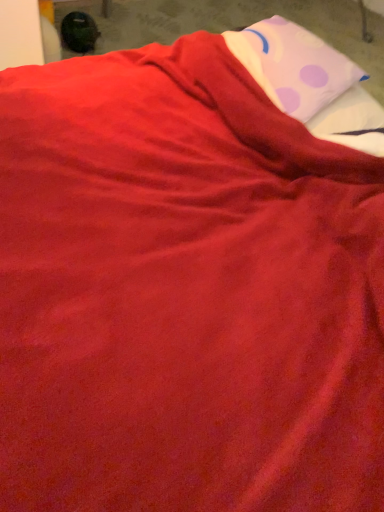
The height and width of the screenshot is (512, 384). Describe the element at coordinates (293, 66) in the screenshot. I see `white soft pillow at upper right` at that location.

Find the location of `white soft pillow at upper right`. white soft pillow at upper right is located at coordinates (293, 66).

Locate an element on the screen. white soft pillow at upper right is located at coordinates (293, 66).